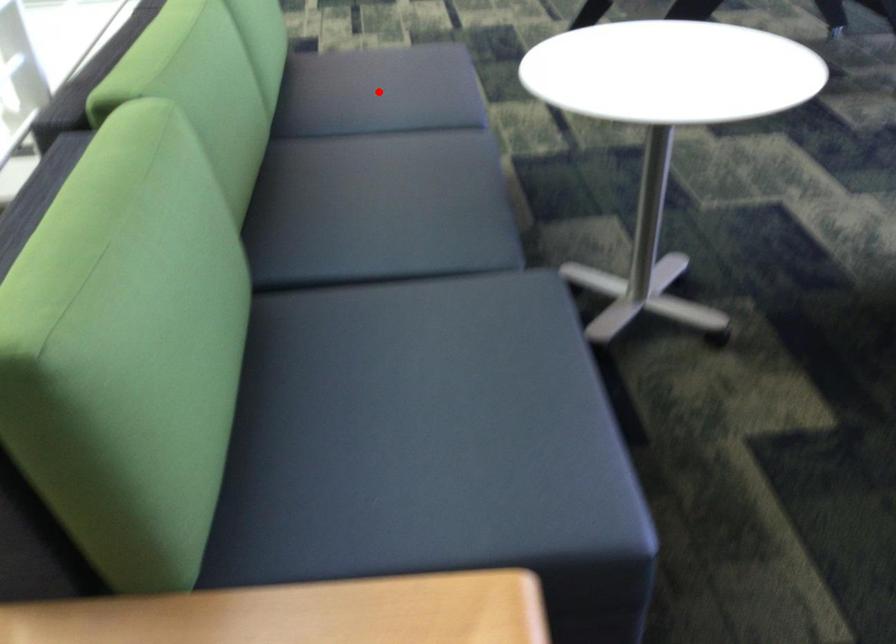
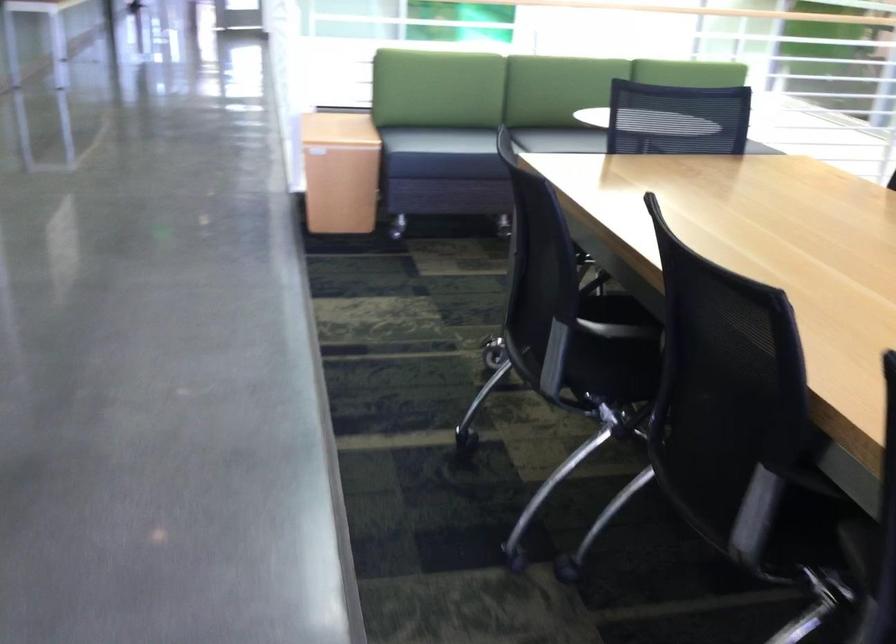
Question: I am providing you with two images of the same scene from different viewpoints. A red point is marked on the first image. Can you still see the location of the red point in image 2?

Choices:
 (A) Yes
 (B) No

Answer: (B)